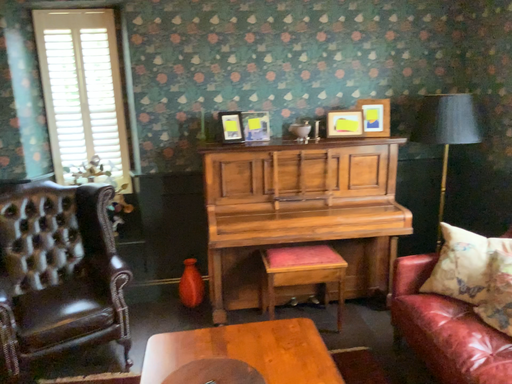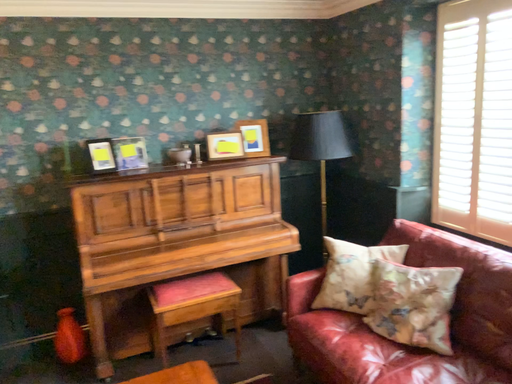
Question: How did the camera likely rotate when shooting the video?

Choices:
 (A) rotated left
 (B) rotated right

Answer: (B)